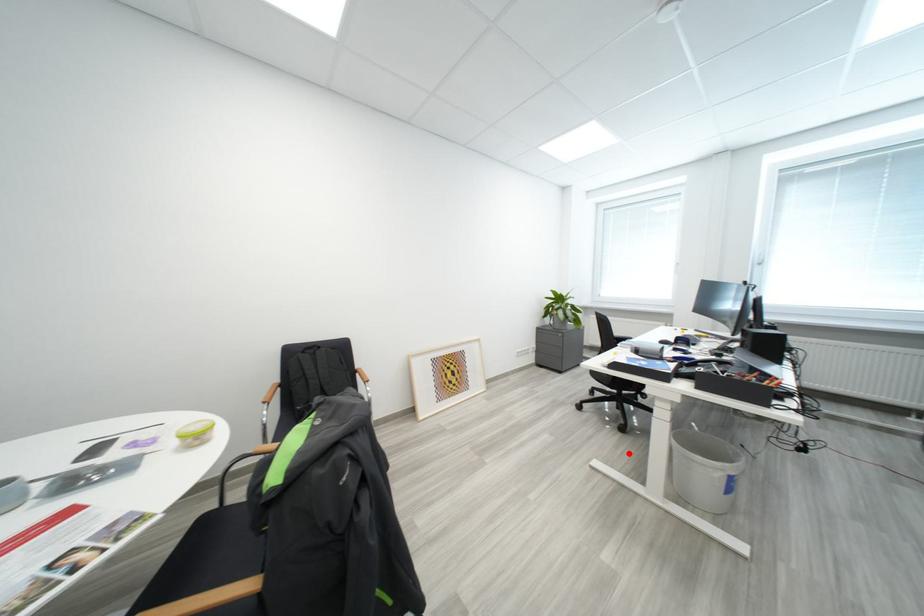
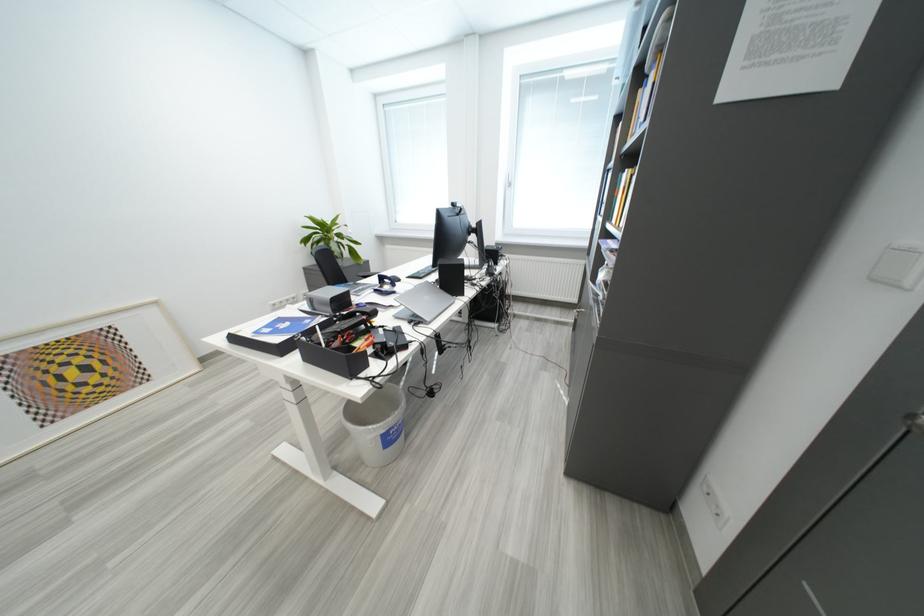
Where in the second image is the point corresponding to the highlighted location from the first image?

(343, 418)